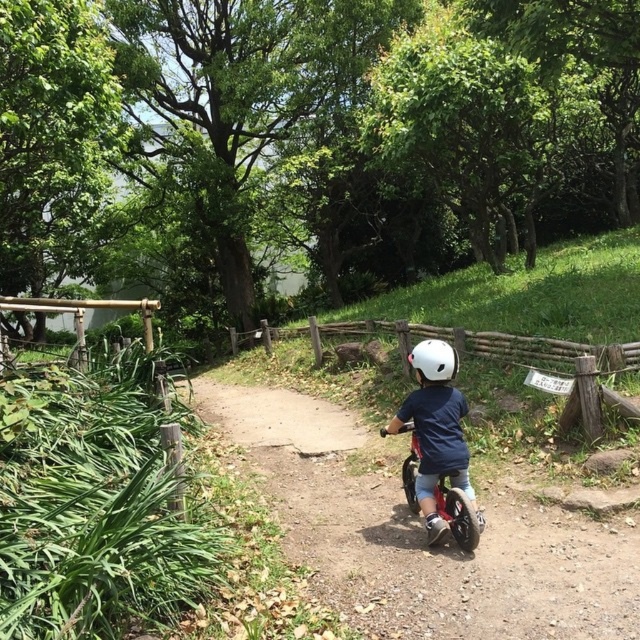
Who is taller, smooth dirt path at center or orange matte bicycle at center?

With more height is orange matte bicycle at center.

Is smooth dirt path at center positioned at the back of orange matte bicycle at center?

That is False.

The height and width of the screenshot is (640, 640). What do you see at coordinates (422, 532) in the screenshot? I see `smooth dirt path at center` at bounding box center [422, 532].

This screenshot has width=640, height=640. Identify the location of smooth dirt path at center. (422, 532).

In the scene shown: Does orange matte bicycle at center have a larger size compared to white matte helmet at center?

Yes, orange matte bicycle at center is bigger than white matte helmet at center.

Which is more to the right, orange matte bicycle at center or white matte helmet at center?

orange matte bicycle at center

Locate an element on the screen. orange matte bicycle at center is located at coordinates (456, 513).

Is smooth dirt path at center bigger than white matte helmet at center?

Yes, smooth dirt path at center is bigger than white matte helmet at center.

Is smooth dirt path at center positioned behind white matte helmet at center?

No, it is in front of white matte helmet at center.

This screenshot has height=640, width=640. Describe the element at coordinates (422, 532) in the screenshot. I see `smooth dirt path at center` at that location.

At what (x,y) coordinates should I click in order to perform the action: click on smooth dirt path at center. Please return your answer as a coordinate pair (x, y). This screenshot has height=640, width=640. Looking at the image, I should click on (422, 532).